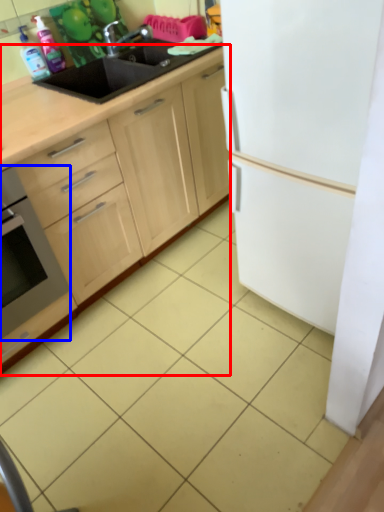
Question: Which object is further to the camera taking this photo, cabinetry (highlighted by a red box) or home appliance (highlighted by a blue box)?

Choices:
 (A) cabinetry
 (B) home appliance

Answer: (B)